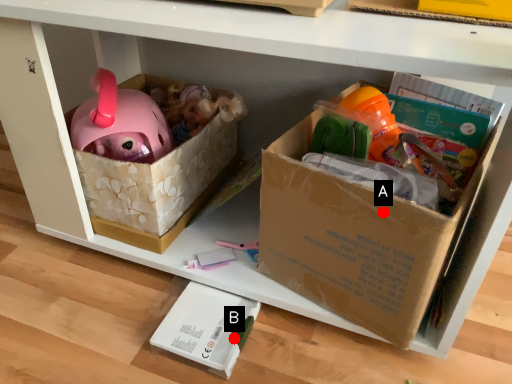
Question: Two points are circled on the image, labeled by A and B beside each circle. Which point is closer to the camera?

Choices:
 (A) A is closer
 (B) B is closer

Answer: (A)